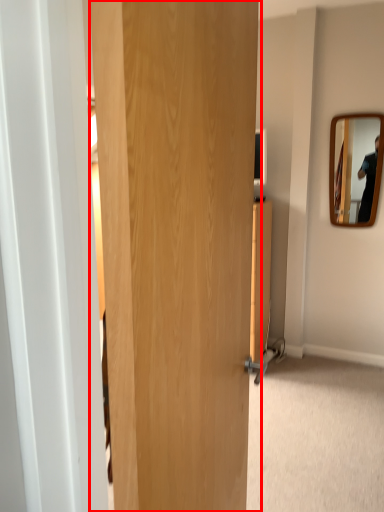
Question: From the image's perspective, where is door (annotated by the red box) located relative to mirror?

Choices:
 (A) above
 (B) below

Answer: (B)